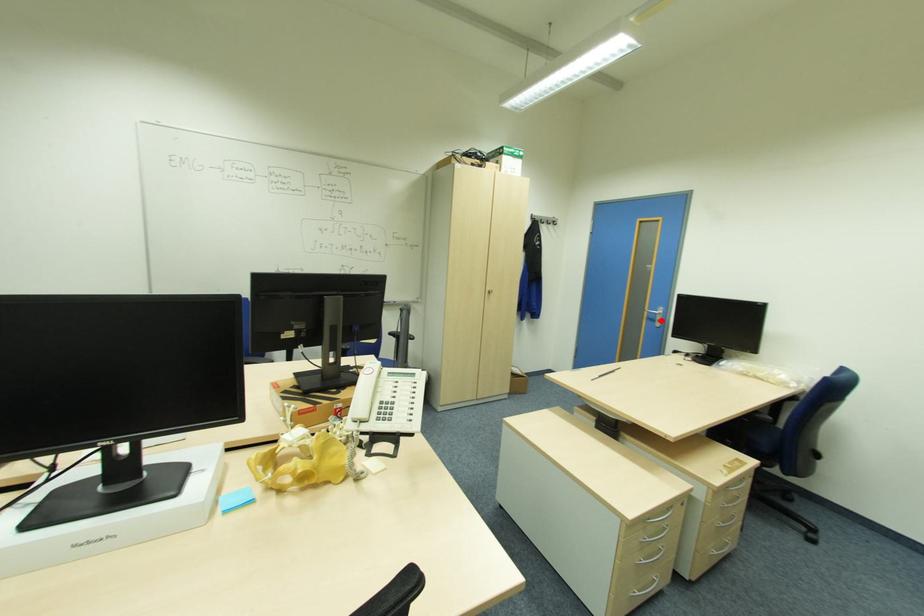
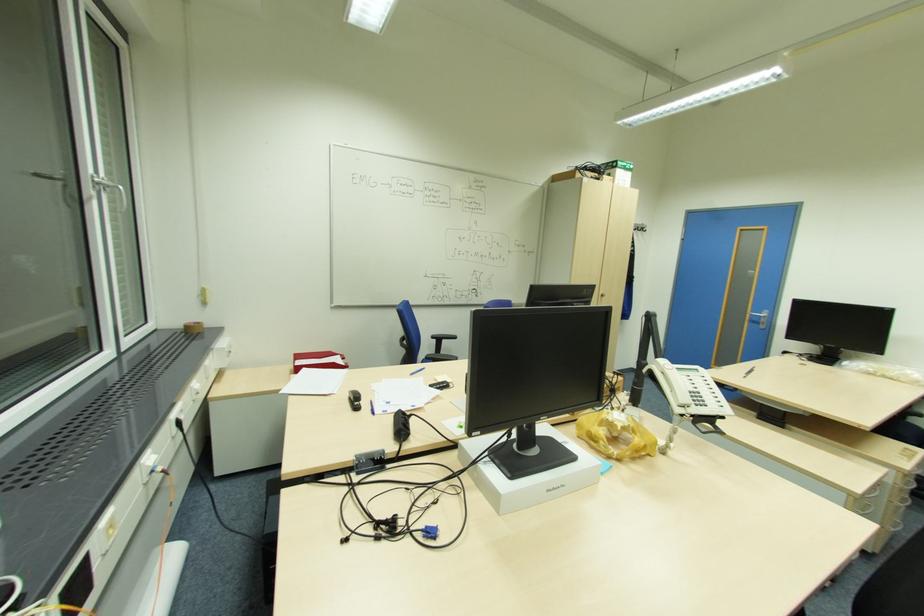
Question: I am providing you with two images of the same scene from different viewpoints. A red point is marked on the first image. At the location where the point appears in image 1, is it still visible in image 2?

Choices:
 (A) Yes
 (B) No

Answer: (A)